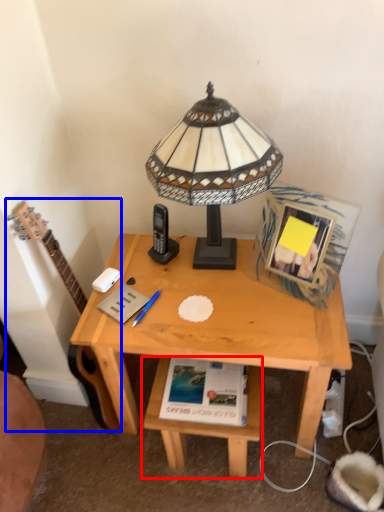
Question: Which object appears farthest to the camera in this image, table (highlighted by a red box) or guitar (highlighted by a blue box)?

Choices:
 (A) table
 (B) guitar

Answer: (A)